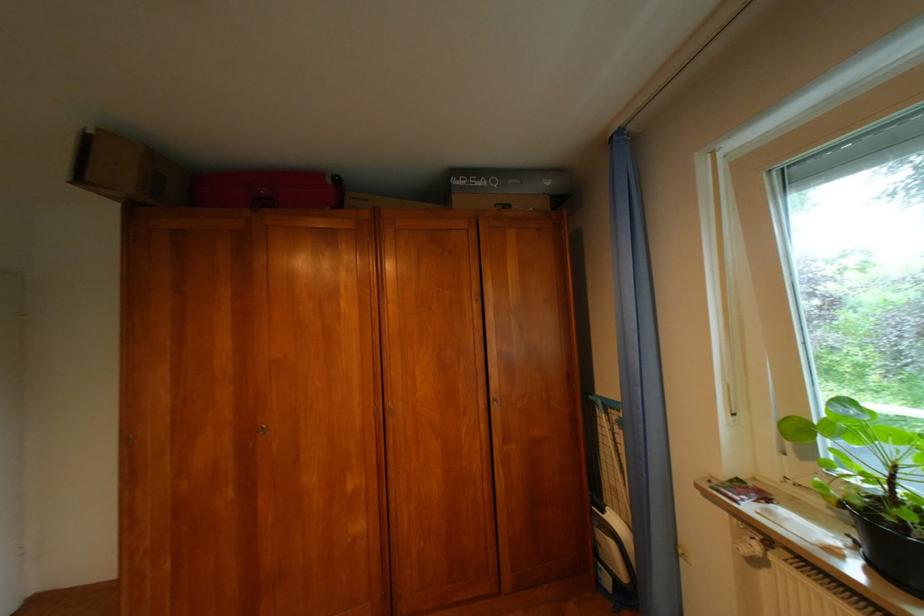
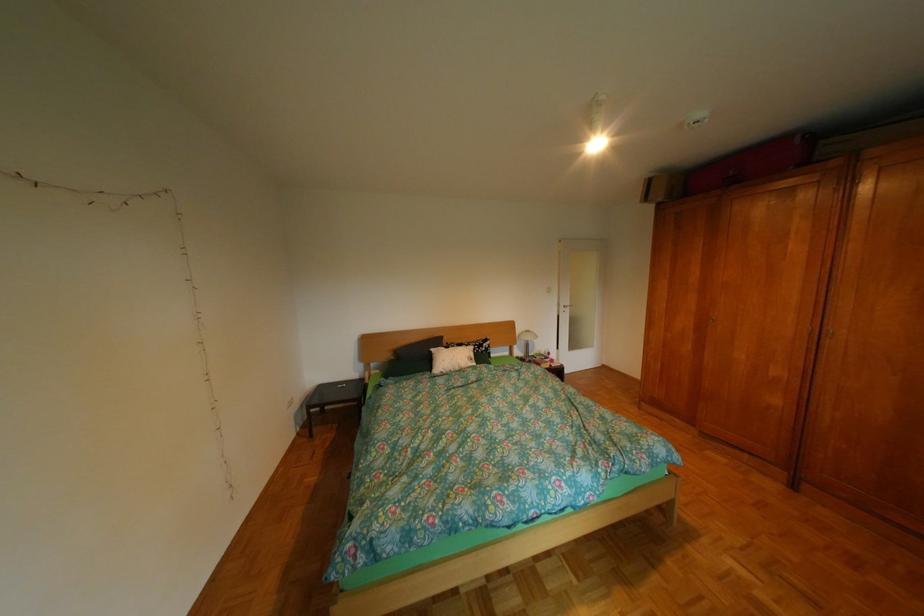
In the second image, find the point that corresponds to point 343,180 in the first image.

(812, 142)